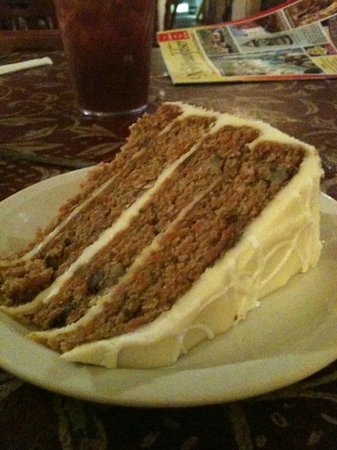
Image resolution: width=337 pixels, height=450 pixels. What are the coordinates of `chair` in the screenshot? It's located at (51, 27).